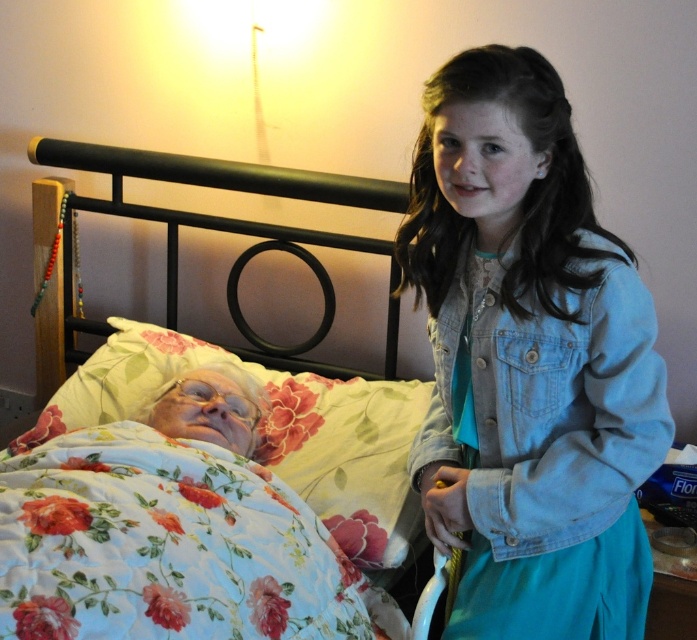
From the picture: Does floral fabric pillow at left have a lesser height compared to metallic black bed at upper left?

Yes.

Can you confirm if floral fabric pillow at left is smaller than metallic black bed at upper left?

Correct, floral fabric pillow at left occupies less space than metallic black bed at upper left.

Is point (358, 426) in front of point (146, 211)?

That is True.

Locate an element on the screen. This screenshot has height=640, width=697. floral fabric pillow at left is located at coordinates (273, 432).

The width and height of the screenshot is (697, 640). I want to click on denim jacket at right, so click(528, 362).

Is denim jacket at right wider than metallic black bed at upper left?

No, denim jacket at right is not wider than metallic black bed at upper left.

Measure the distance between denim jacket at right and camera.

denim jacket at right and camera are 3.42 feet apart from each other.

Locate an element on the screen. denim jacket at right is located at coordinates (528, 362).

Between denim jacket at right and floral fabric pillow at left, which one appears on the right side from the viewer's perspective?

From the viewer's perspective, denim jacket at right appears more on the right side.

Is point (514, 154) closer to camera compared to point (395, 428)?

Yes, it is.

The height and width of the screenshot is (640, 697). I want to click on denim jacket at right, so (528, 362).